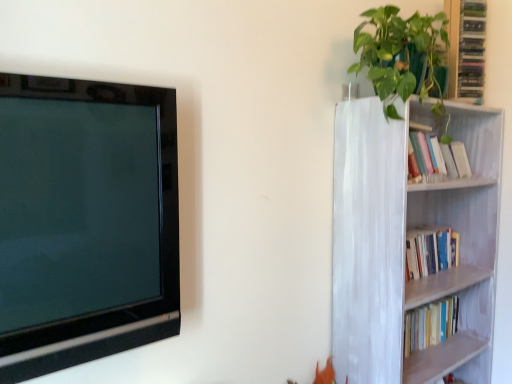
Question: Considering their positions, is green glossy cabinet at upper right located in front of or behind black glossy television at left?

Choices:
 (A) behind
 (B) front

Answer: (A)

Question: Is green glossy cabinet at upper right taller or shorter than black glossy television at left?

Choices:
 (A) tall
 (B) short

Answer: (B)

Question: Which of these objects is positioned closest to the green glossy cabinet at upper right?

Choices:
 (A) black glossy television at left
 (B) white painted wood bookcase at right
 (C) green glossy plant at upper right

Answer: (C)

Question: Which is nearer to the green glossy cabinet at upper right?

Choices:
 (A) white painted wood bookcase at right
 (B) green glossy plant at upper right
 (C) black glossy television at left

Answer: (B)